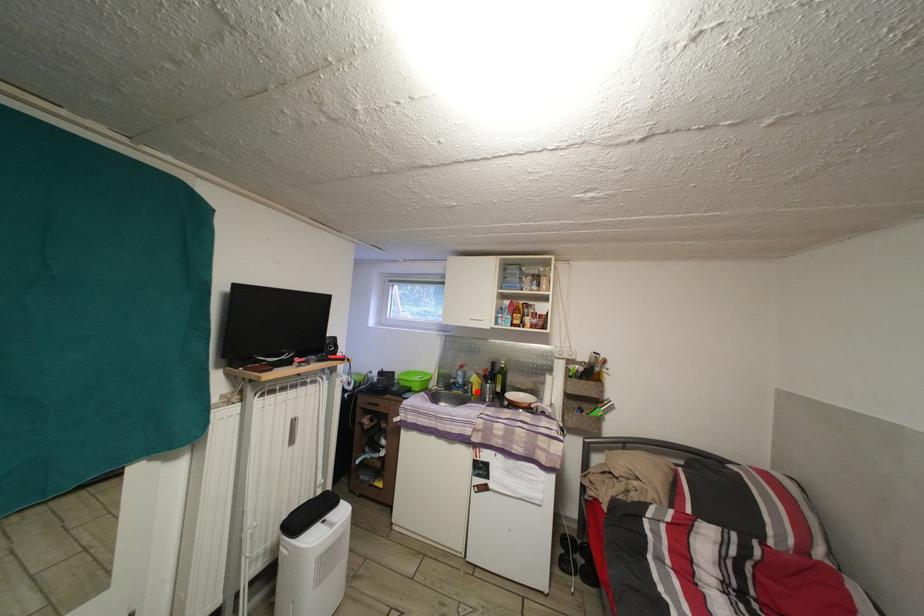
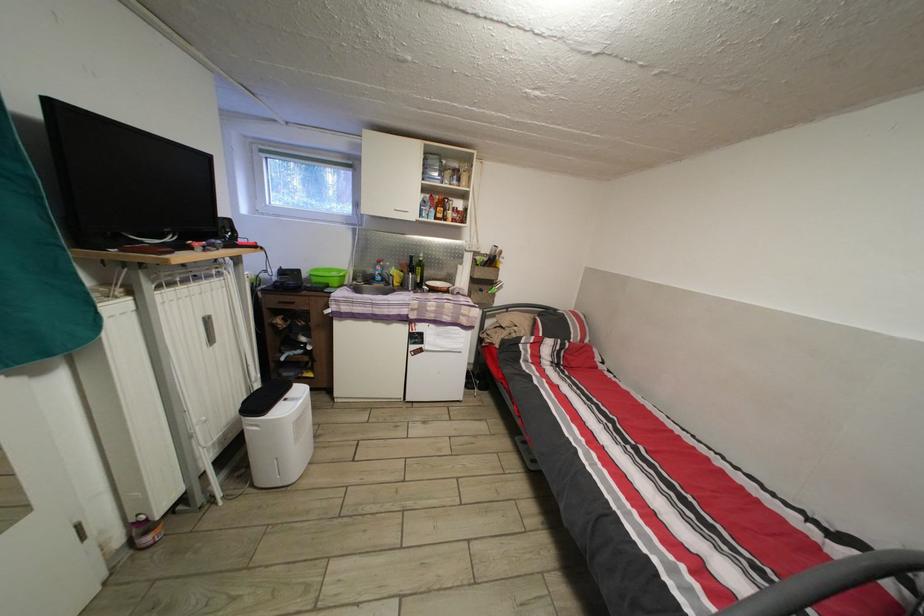
Locate, in the second image, the point that corresponds to the highlighted location in the first image.

(398, 285)